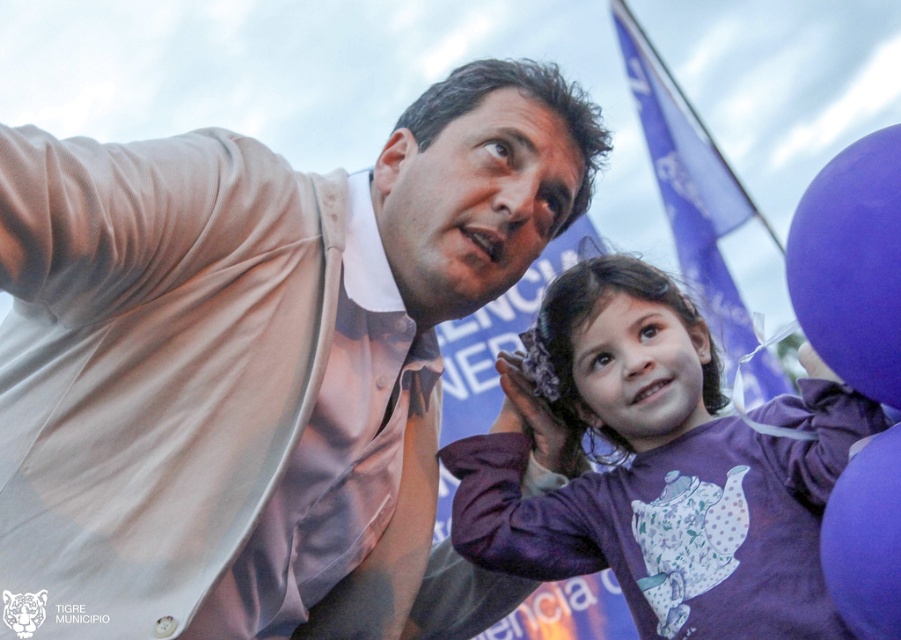
Question: Considering the relative positions of satin beige shirt at upper left and purple matte shirt at center in the image provided, where is satin beige shirt at upper left located with respect to purple matte shirt at center?

Choices:
 (A) left
 (B) right

Answer: (A)

Question: Which point appears farthest from the camera in this image?

Choices:
 (A) (510, 465)
 (B) (366, 518)
 (C) (894, 289)
 (D) (872, 536)

Answer: (A)

Question: Which point is farther to the camera?

Choices:
 (A) purple matte shirt at center
 (B) purple fabric flag at upper right
 (C) satin beige shirt at upper left

Answer: (B)

Question: Can you confirm if purple matte shirt at center is positioned below purple fabric flag at upper right?

Choices:
 (A) no
 (B) yes

Answer: (B)

Question: Which point appears closest to the camera in this image?

Choices:
 (A) (881, 609)
 (B) (815, 237)

Answer: (A)

Question: Is the position of purple matte balloon at upper right less distant than that of purple fabric flag at upper right?

Choices:
 (A) yes
 (B) no

Answer: (A)